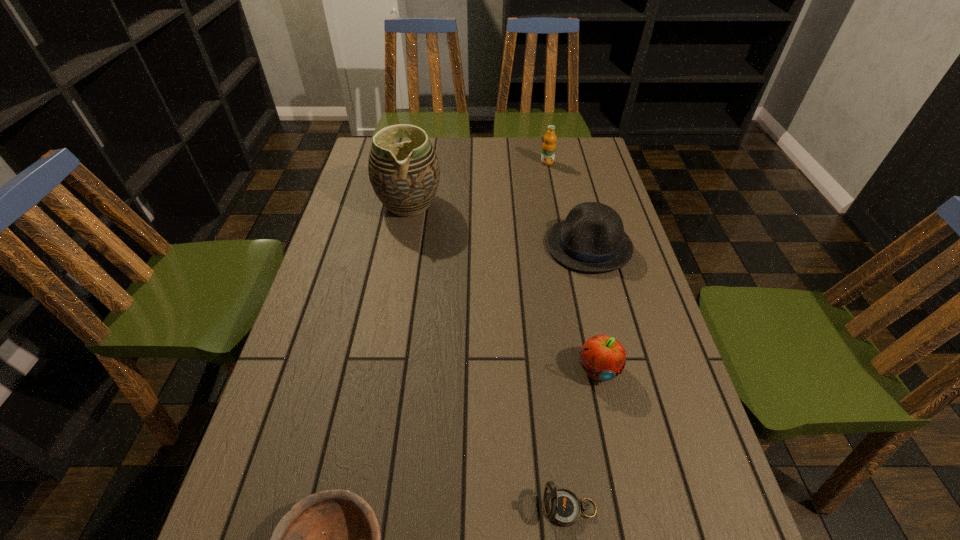
Locate an element on the screen. vacant space at the right edge of the desktop is located at coordinates (603, 176).

Locate an element on the screen. The width and height of the screenshot is (960, 540). vacant space at the far right corner of the desktop is located at coordinates (559, 143).

Locate an element on the screen. The width and height of the screenshot is (960, 540). empty location between the bowler hat and the farthest object is located at coordinates (567, 204).

Locate an element on the screen. Image resolution: width=960 pixels, height=540 pixels. vacant area that lies between the orange juice and the compass is located at coordinates (559, 335).

Identify the location of empty space between the pottery and the bowler hat. (499, 225).

At what (x,y) coordinates should I click in order to perform the action: click on blank region between the fourth farthest object and the bowler hat. Please return your answer as a coordinate pair (x, y). The image size is (960, 540). Looking at the image, I should click on (592, 307).

At what (x,y) coordinates should I click in order to perform the action: click on free space between the compass and the bowler hat. Please return your answer as a coordinate pair (x, y). The image size is (960, 540). Looking at the image, I should click on (579, 377).

What are the coordinates of `free spot between the orange juice and the bowler hat` in the screenshot? It's located at (567, 204).

Locate an element on the screen. free space between the farthest object and the tallest object is located at coordinates (478, 183).

The image size is (960, 540). I want to click on object that is the second closest to the pottery, so pos(549,145).